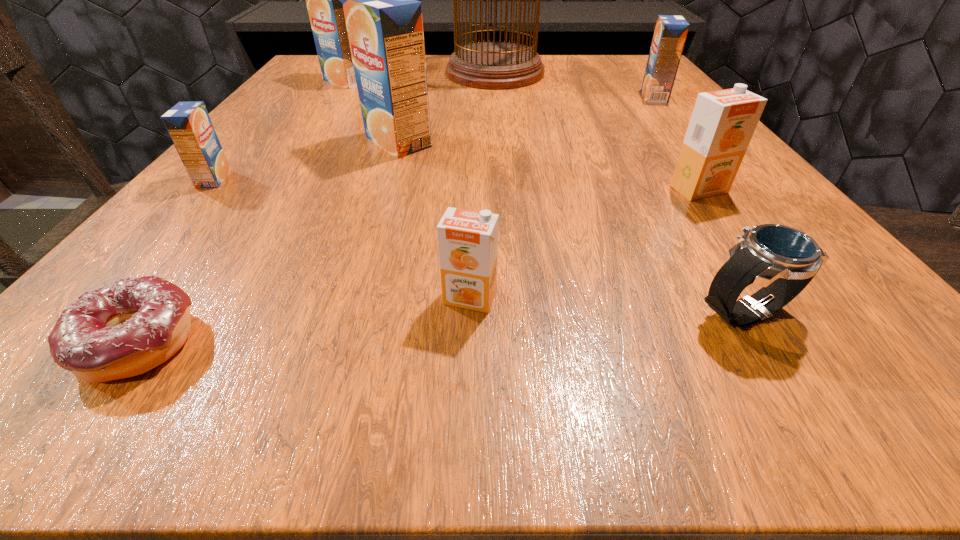
Find the location of `free space at the near right corner of the desktop`. free space at the near right corner of the desktop is located at coordinates (771, 334).

Where is `free spot between the right orange orange juice and the watch`? The height and width of the screenshot is (540, 960). free spot between the right orange orange juice and the watch is located at coordinates (722, 251).

Identify the location of free space between the tallest orange juice and the right orange orange juice. The width and height of the screenshot is (960, 540). (548, 166).

The image size is (960, 540). What are the coordinates of `free spot between the tallest object and the nearer orange orange juice` in the screenshot? It's located at coord(483,185).

Where is `free space between the bigger orange orange juice and the tallest object`? This screenshot has height=540, width=960. free space between the bigger orange orange juice and the tallest object is located at coordinates (597, 131).

This screenshot has width=960, height=540. Find the location of `free space between the tallest object and the shortest object`. free space between the tallest object and the shortest object is located at coordinates (316, 207).

Find the location of `free spot between the second nearest blue orange_juice and the leftmost blue orange_juice`. free spot between the second nearest blue orange_juice and the leftmost blue orange_juice is located at coordinates (306, 160).

At what (x,y) coordinates should I click in order to perform the action: click on free space between the birdcage and the rightmost blue orange_juice. Please return your answer as a coordinate pair (x, y). Looking at the image, I should click on (575, 85).

You are a GUI agent. You are given a task and a screenshot of the screen. Output one action in this format:
    pyautogui.click(x=<x>, y=<y>)
    Task: Click on the free space between the silver watch and the doughnut
    
    Given the screenshot: What is the action you would take?
    pyautogui.click(x=441, y=327)

You are a GUI agent. You are given a task and a screenshot of the screen. Output one action in this format:
    pyautogui.click(x=<x>, y=<y>)
    Task: Click on the free space between the pink doughnut and the bigger orange orange juice
    Image resolution: width=960 pixels, height=540 pixels.
    Given the screenshot: What is the action you would take?
    pyautogui.click(x=418, y=266)